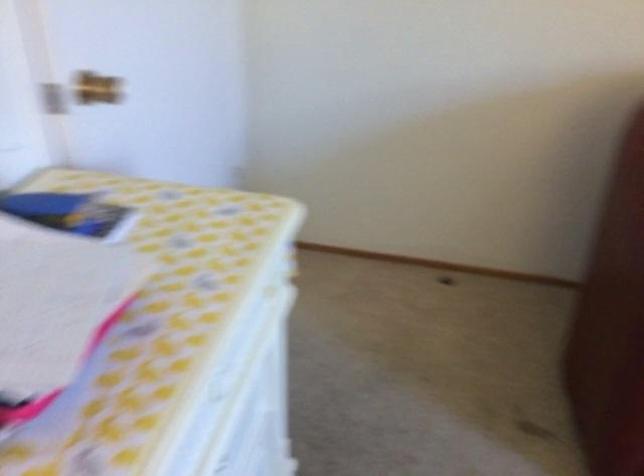
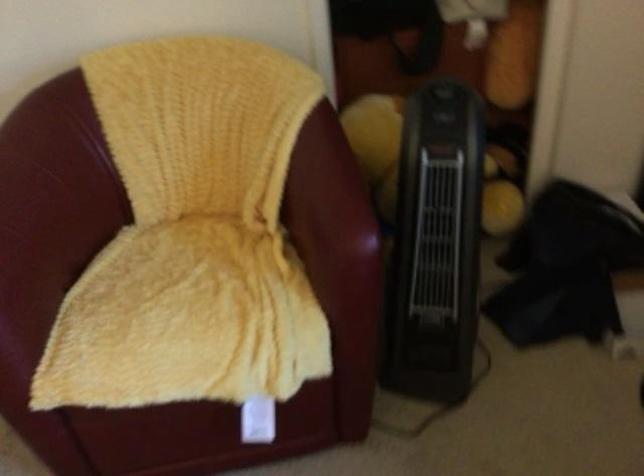
Question: Which direction would the cameraman need to move to produce the second image? Reply with the corresponding letter.

Choices:
 (A) Left
 (B) Right
 (C) Forward
 (D) Backward

Answer: (B)